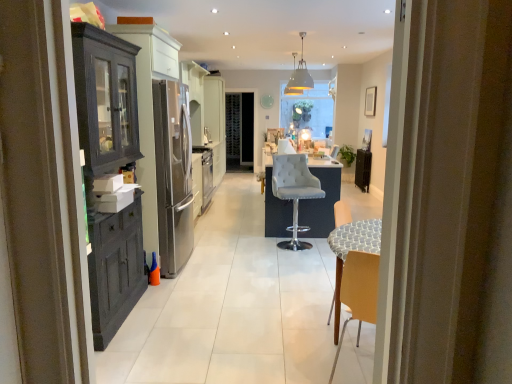
Question: From a real-world perspective, is gray fabric bar stool at center positioned over black metallic radiator at right based on gravity?

Choices:
 (A) yes
 (B) no

Answer: (A)

Question: From a real-world perspective, does gray fabric bar stool at center sit lower than black metallic radiator at right?

Choices:
 (A) no
 (B) yes

Answer: (A)

Question: From the image's perspective, is gray fabric bar stool at center over black metallic radiator at right?

Choices:
 (A) no
 (B) yes

Answer: (A)

Question: Can black metallic radiator at right be found inside gray fabric bar stool at center?

Choices:
 (A) yes
 (B) no

Answer: (B)

Question: Is gray fabric bar stool at center positioned with its back to black metallic radiator at right?

Choices:
 (A) no
 (B) yes

Answer: (A)

Question: Would you say metallic pendant light at upper center is to the left or to the right of matte dark wood cabinet at left in the picture?

Choices:
 (A) right
 (B) left

Answer: (A)

Question: Is metallic pendant light at upper center wider or thinner than matte dark wood cabinet at left?

Choices:
 (A) wide
 (B) thin

Answer: (B)

Question: Relative to matte dark wood cabinet at left, is metallic pendant light at upper center in front or behind?

Choices:
 (A) behind
 (B) front

Answer: (A)

Question: Looking at the image, does metallic pendant light at upper center seem bigger or smaller compared to matte dark wood cabinet at left?

Choices:
 (A) big
 (B) small

Answer: (B)

Question: From the image's perspective, is metallic pendant light at upper center above or below gray fabric bar stool at center?

Choices:
 (A) above
 (B) below

Answer: (A)

Question: In the image, is metallic pendant light at upper center positioned in front of or behind gray fabric bar stool at center?

Choices:
 (A) front
 (B) behind

Answer: (B)

Question: In terms of size, does metallic pendant light at upper center appear bigger or smaller than gray fabric bar stool at center?

Choices:
 (A) small
 (B) big

Answer: (A)

Question: Is point (305, 62) positioned closer to the camera than point (317, 185)?

Choices:
 (A) closer
 (B) farther

Answer: (B)

Question: Considering their positions, is matte dark wood cabinet at left located in front of or behind black metallic radiator at right?

Choices:
 (A) behind
 (B) front

Answer: (B)

Question: From the image's perspective, is matte dark wood cabinet at left located above or below black metallic radiator at right?

Choices:
 (A) below
 (B) above

Answer: (A)